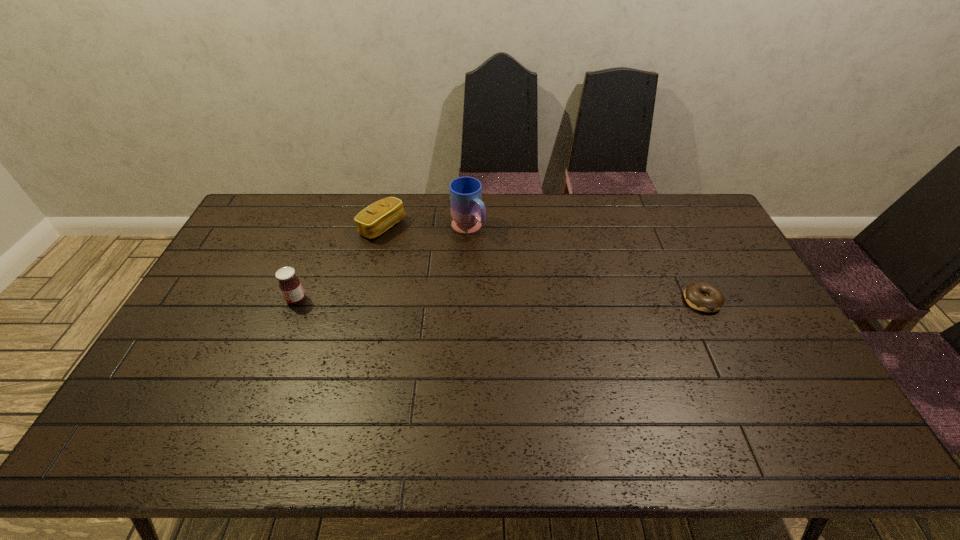
Where is `free space on the desktop that is between the jam and the shortest object and is positioned on the side of the second object from right to left with the handle`? free space on the desktop that is between the jam and the shortest object and is positioned on the side of the second object from right to left with the handle is located at coordinates (544, 300).

Find the location of a particular element. This screenshot has width=960, height=540. free space on the desktop that is between the leftmost object and the doughnut and is positioned on the zipper side of the second object from left to right is located at coordinates (500, 300).